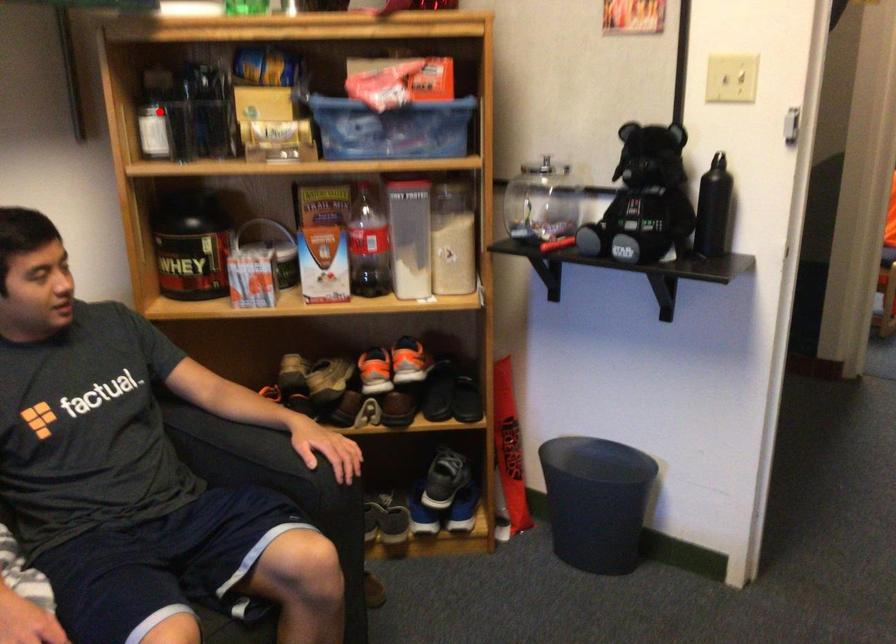
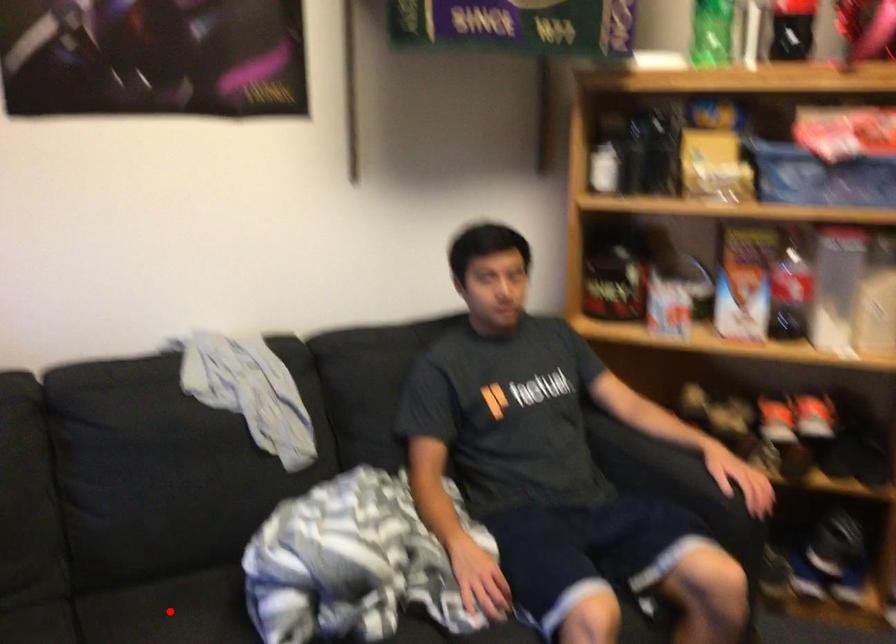
I am providing you with two images of the same scene from different viewpoints. A red point is marked on the first image and another point is marked on the second image. Does the point marked in image1 correspond to the same location as the one in image2?

No